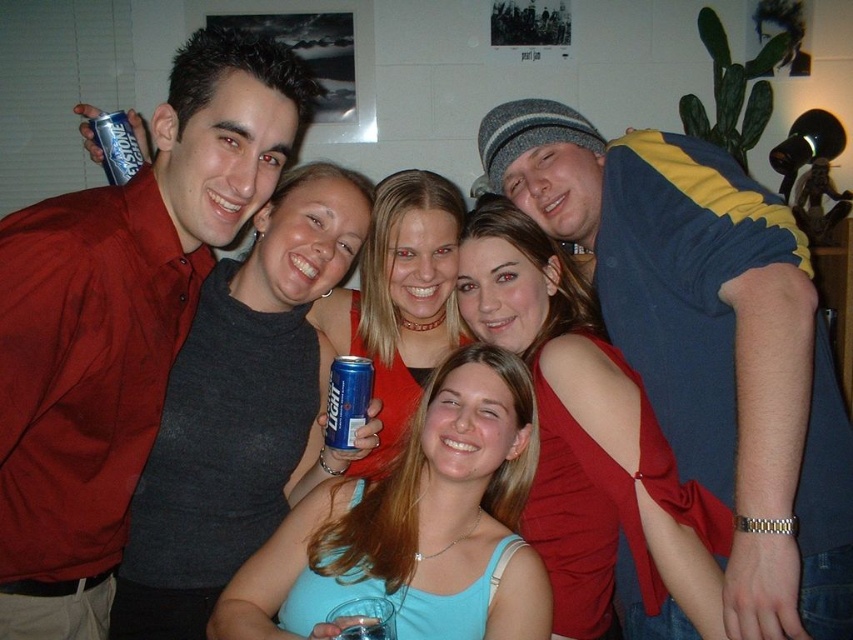
Is point (680, 195) closer to camera compared to point (96, 122)?

Yes.

Who is positioned more to the right, blue and yellow striped shirt at upper right or blue metallic can at upper left?

blue and yellow striped shirt at upper right is more to the right.

At what (x,y) coordinates should I click in order to perform the action: click on blue and yellow striped shirt at upper right. Please return your answer as a coordinate pair (x, y). Looking at the image, I should click on (708, 342).

Can you confirm if matte gray tank top at center is positioned to the left of blue metallic can at upper left?

Incorrect, matte gray tank top at center is not on the left side of blue metallic can at upper left.

Is matte gray tank top at center bigger than blue metallic can at upper left?

Yes, matte gray tank top at center is bigger than blue metallic can at upper left.

Is point (209, 388) farther from viewer compared to point (108, 170)?

No, it is not.

Locate an element on the screen. The height and width of the screenshot is (640, 853). matte gray tank top at center is located at coordinates (242, 410).

Can you confirm if matte red dress at center is shorter than blue metallic can at upper left?

No, matte red dress at center is not shorter than blue metallic can at upper left.

Can you confirm if matte red dress at center is wider than blue metallic can at upper left?

Indeed, matte red dress at center has a greater width compared to blue metallic can at upper left.

Is point (454, 212) positioned in front of point (131, 177)?

That is False.

Locate an element on the screen. Image resolution: width=853 pixels, height=640 pixels. matte red dress at center is located at coordinates (399, 298).